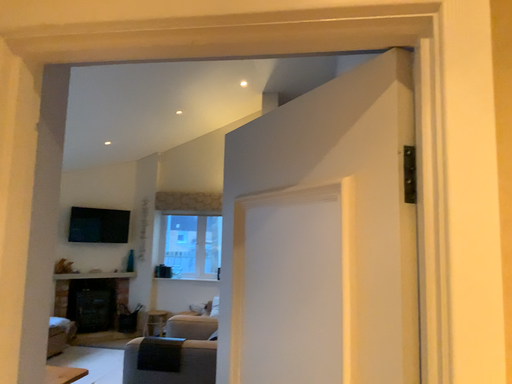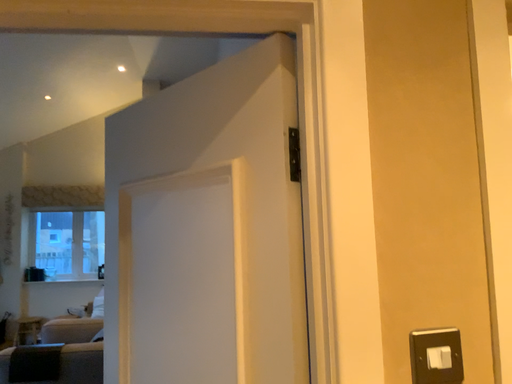
Question: Which way did the camera rotate in the video?

Choices:
 (A) rotated right
 (B) rotated left

Answer: (A)